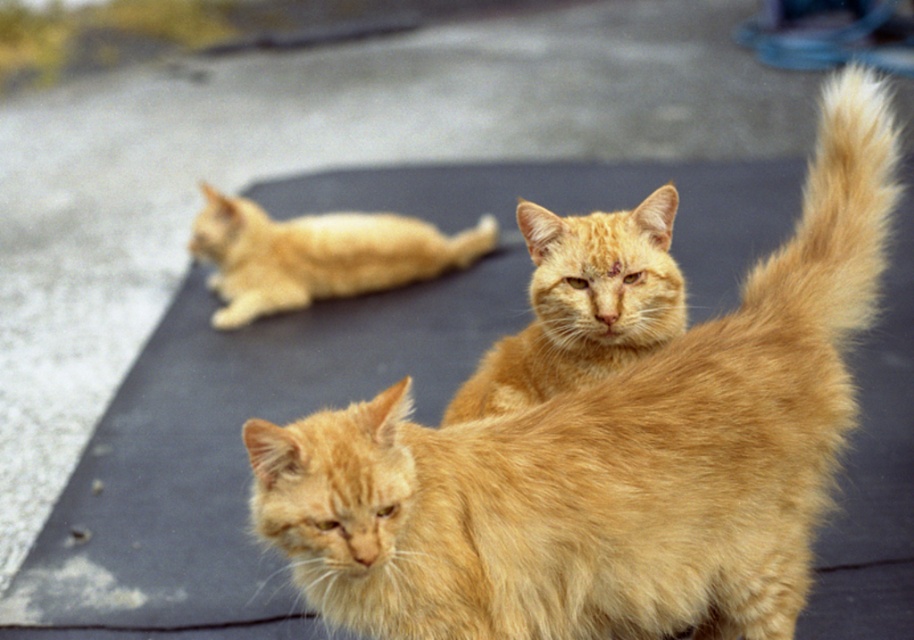
Measure the distance between fluffy orange cat at center and blonde fur cat at upper left.

fluffy orange cat at center is 96.96 centimeters away from blonde fur cat at upper left.

Who is positioned more to the left, fluffy orange cat at center or blonde fur cat at upper left?

From the viewer's perspective, blonde fur cat at upper left appears more on the left side.

The height and width of the screenshot is (640, 914). I want to click on fluffy orange cat at center, so click(611, 458).

Can you confirm if orange fur cat at center is shorter than blonde fur cat at upper left?

No, orange fur cat at center is not shorter than blonde fur cat at upper left.

Does point (505, 369) lie in front of point (192, 234)?

Yes, point (505, 369) is closer to viewer.

You are a GUI agent. You are given a task and a screenshot of the screen. Output one action in this format:
    pyautogui.click(x=<x>, y=<y>)
    Task: Click on the orange fur cat at center
    This screenshot has height=640, width=914.
    Given the screenshot: What is the action you would take?
    pyautogui.click(x=582, y=305)

Does orange fur cat at center have a greater width compared to fluffy golden tail at upper right?

Yes.

Which is below, orange fur cat at center or fluffy golden tail at upper right?

Positioned lower is orange fur cat at center.

Between point (615, 358) and point (881, 236), which one is positioned in front?

Point (881, 236) is more forward.

The height and width of the screenshot is (640, 914). I want to click on orange fur cat at center, so (x=582, y=305).